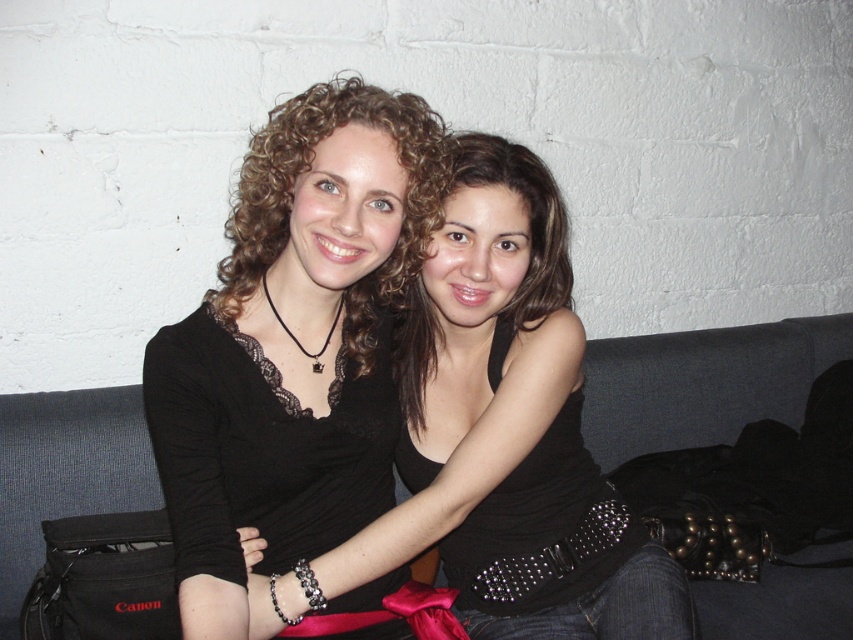
You are a guest at a party and see the dark gray fabric couch at center and the black lace dress at center. Which object is positioned to the right of the other?

The dark gray fabric couch at center is positioned to the right of the black lace dress at center.

You are standing in front of the couch where the two people are sitting. There are two points marked on the couch. The first point is at coordinate point (173,404) and the second is at point (500,321). If you want to place a small gift on the couch closer to the front of the couch, which point should you choose?

You should place the small gift on point (173,404) because it is in front of point (500,321).